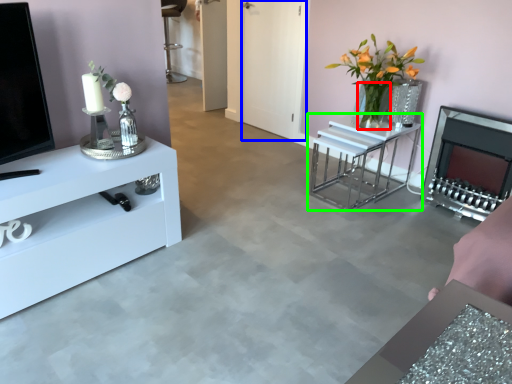
Question: Based on their relative distances, which object is nearer to glass vase (highlighted by a red box)? Choose from glass door (highlighted by a blue box) and table (highlighted by a green box).

Choices:
 (A) glass door
 (B) table

Answer: (B)